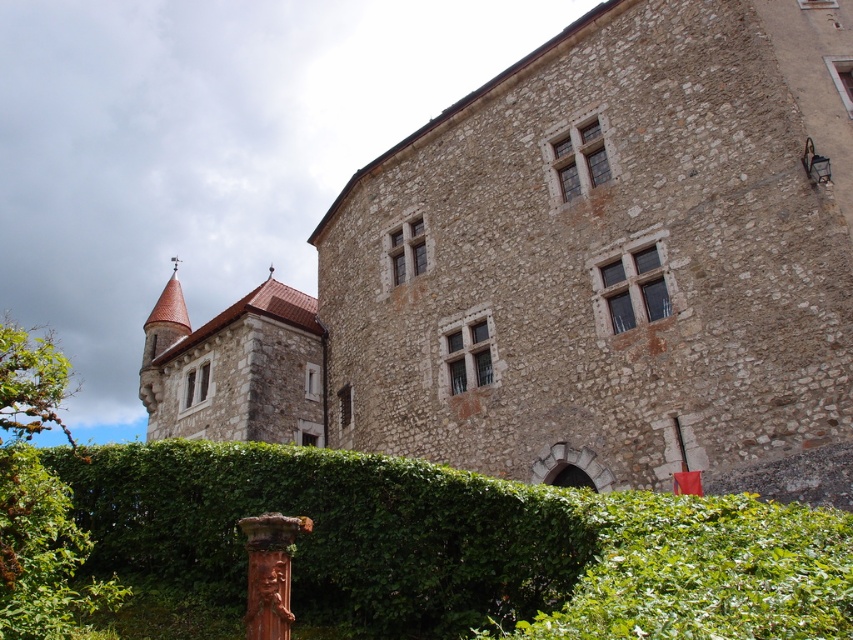
Question: Which of the following is the closest to the observer?

Choices:
 (A) green leafy hedge at lower center
 (B) brown stone castle at center

Answer: (A)

Question: Can you confirm if brown stone castle at center is smaller than green leafy hedge at lower center?

Choices:
 (A) yes
 (B) no

Answer: (B)

Question: From the image, what is the correct spatial relationship of brown stone castle at center in relation to green leafy hedge at lower center?

Choices:
 (A) right
 (B) left

Answer: (B)

Question: Among these points, which one is nearest to the camera?

Choices:
 (A) tap(490, 529)
 (B) tap(421, 196)

Answer: (A)

Question: Considering the relative positions of brown stone castle at center and green leafy hedge at lower center in the image provided, where is brown stone castle at center located with respect to green leafy hedge at lower center?

Choices:
 (A) above
 (B) below

Answer: (A)